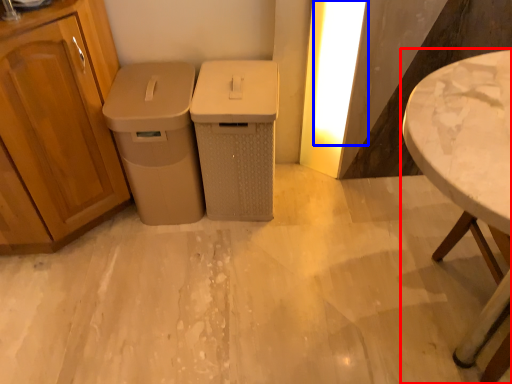
Question: Which object appears closest to the camera in this image, table (highlighted by a red box) or light (highlighted by a blue box)?

Choices:
 (A) table
 (B) light

Answer: (A)